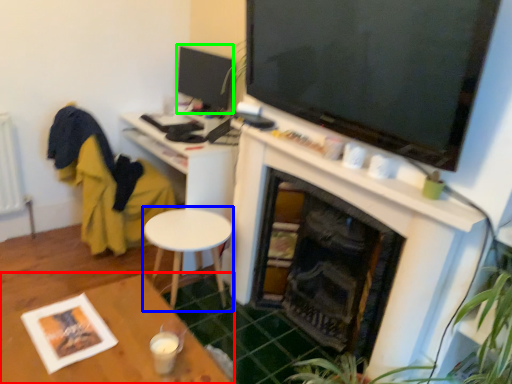
Question: Considering the real-world distances, which object is closest to table (highlighted by a red box)? round table (highlighted by a blue box) or tv show (highlighted by a green box).

Choices:
 (A) round table
 (B) tv show

Answer: (A)